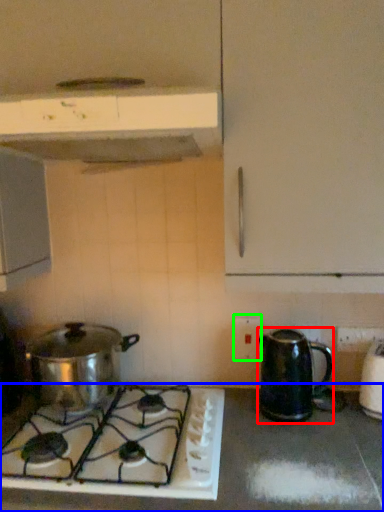
Question: Based on their relative distances, which object is nearer to kitchen appliance (highlighted by a red box)? Choose from countertop (highlighted by a blue box) and electric outlet (highlighted by a green box).

Choices:
 (A) countertop
 (B) electric outlet

Answer: (B)